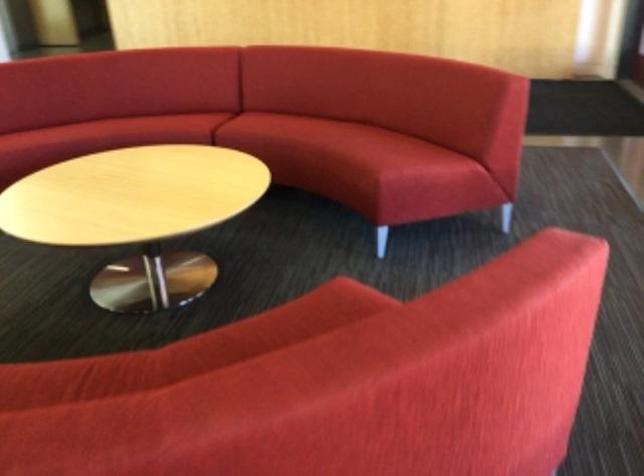
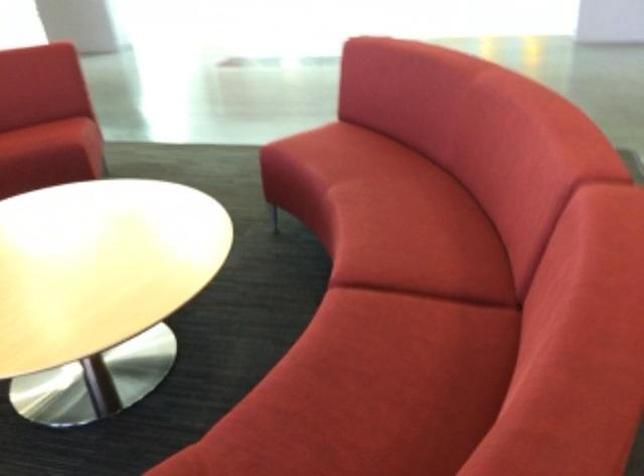
Find the pixel in the second image that matches (x=185, y=115) in the first image.

(418, 239)